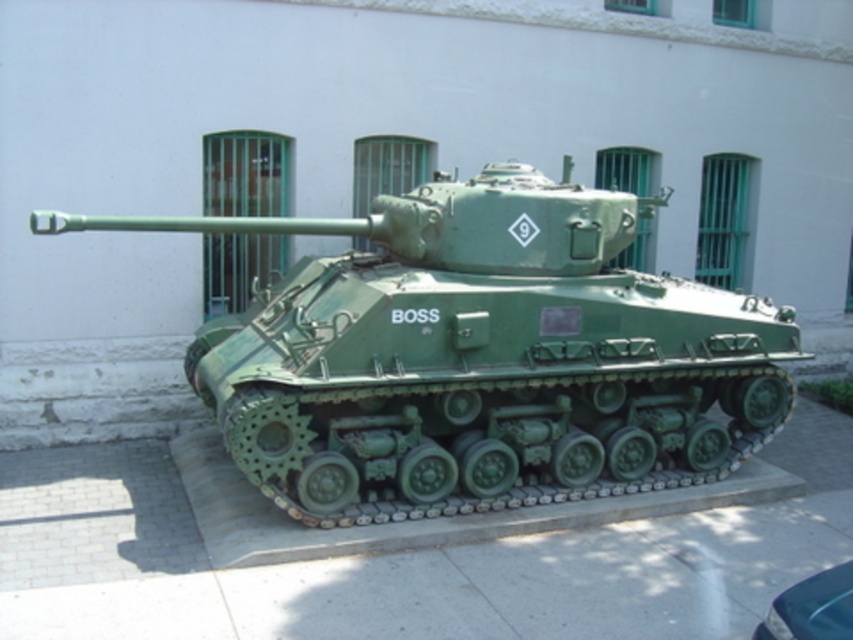
Question: Can you confirm if green matte tank at center is wider than green rubber tracks at lower center?

Choices:
 (A) yes
 (B) no

Answer: (B)

Question: Which point is farther to the camera?

Choices:
 (A) green matte tank at center
 (B) shiny black car at lower right
 (C) green rubber tracks at lower center

Answer: (A)

Question: Which point appears closest to the camera in this image?

Choices:
 (A) (271, 547)
 (B) (329, 406)
 (C) (850, 632)

Answer: (C)

Question: Is green matte tank at center further to camera compared to shiny black car at lower right?

Choices:
 (A) no
 (B) yes

Answer: (B)

Question: Estimate the real-world distances between objects in this image. Which object is closer to the green rubber tracks at lower center?

Choices:
 (A) shiny black car at lower right
 (B) green matte tank at center

Answer: (B)

Question: Can you confirm if green matte tank at center is bigger than shiny black car at lower right?

Choices:
 (A) yes
 (B) no

Answer: (A)